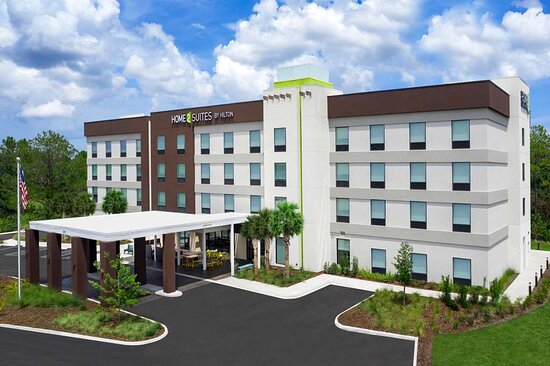
Identify the location of upper story window. Image resolution: width=550 pixels, height=366 pixels. (95, 150), (109, 151), (122, 153), (137, 151), (158, 147), (253, 141), (228, 141), (421, 135).